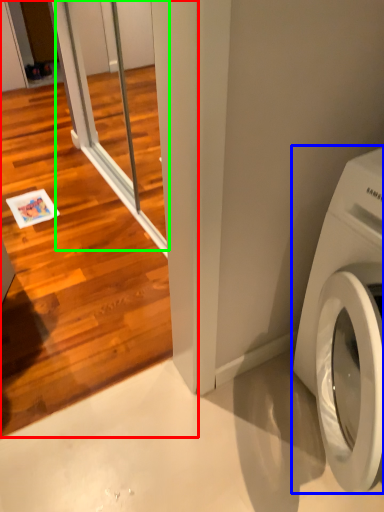
Question: Which object is the farthest from screen door (highlighted by a red box)? Choose among these: washing machine (highlighted by a blue box) or screen door (highlighted by a green box).

Choices:
 (A) washing machine
 (B) screen door

Answer: (A)